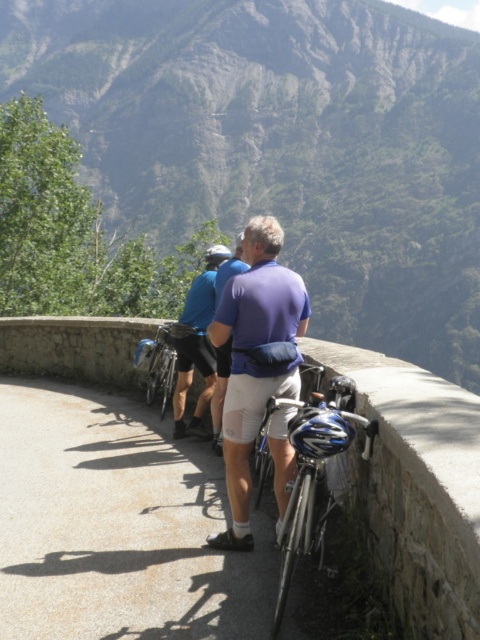
Is the position of purple matte shirt at center less distant than that of blue matte bicycle helmet at center?

No.

Is purple matte shirt at center bigger than blue matte bicycle helmet at center?

Yes.

Does point (241, 342) come in front of point (305, 406)?

No.

What are the coordinates of `purple matte shirt at center` in the screenshot? It's located at (252, 362).

Is blue matte bicycle helmet at center behind blue fabric shirt at center?

No.

Between point (310, 419) and point (217, 429), which one is positioned behind?

The point (217, 429) is behind.

Find the location of a particular element. This screenshot has height=640, width=480. blue matte bicycle helmet at center is located at coordinates (319, 432).

Is shiny metallic bicycle at lower right above blue fabric shirt at center?

Actually, shiny metallic bicycle at lower right is below blue fabric shirt at center.

Which is in front, point (320, 499) or point (220, 360)?

Point (320, 499) is in front.

At what (x,y) coordinates should I click in order to perform the action: click on shiny metallic bicycle at lower right. Please return your answer as a coordinate pair (x, y). The height and width of the screenshot is (640, 480). Looking at the image, I should click on (311, 472).